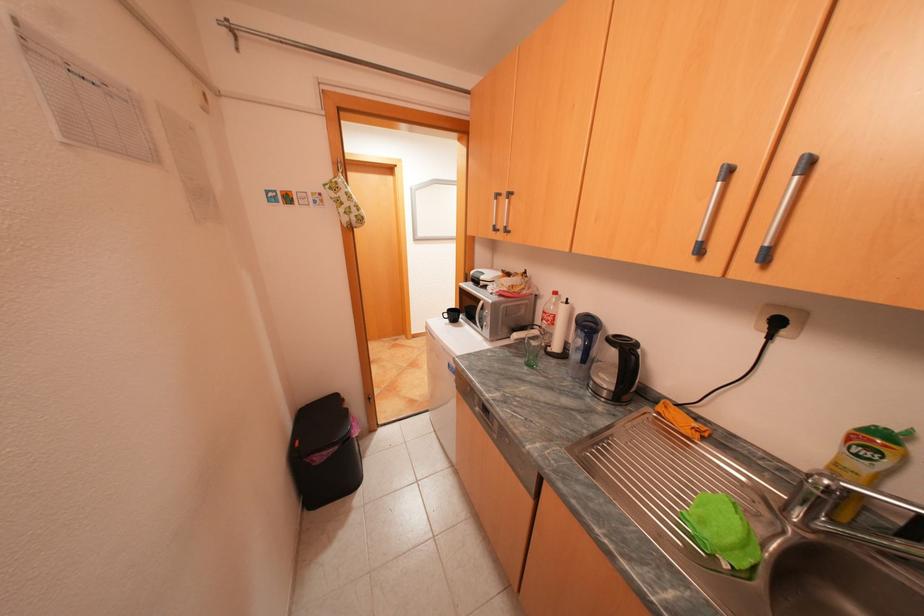
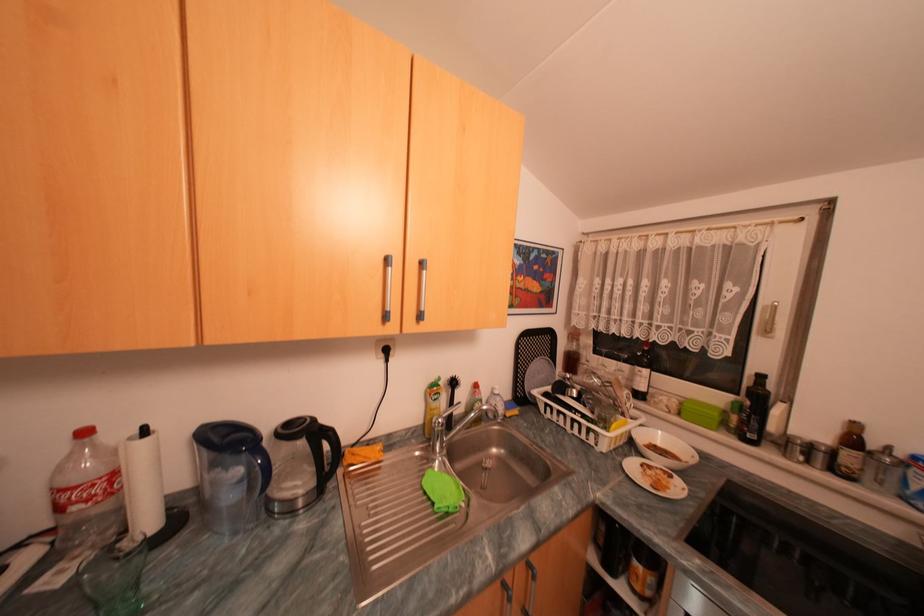
In the second image, find the point that corresponds to point (565, 293) in the first image.

(94, 432)